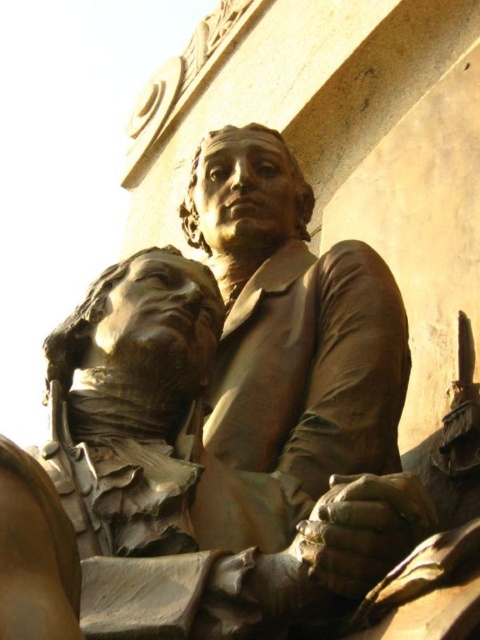
Question: Observing the image, what is the correct spatial positioning of bronze statue at center in reference to bronze bust at center?

Choices:
 (A) below
 (B) above

Answer: (B)

Question: Which point is farther to the camera?

Choices:
 (A) (317, 484)
 (B) (216, 317)

Answer: (B)

Question: Among these objects, which one is nearest to the camera?

Choices:
 (A) bronze bust at center
 (B) bronze statue at center

Answer: (A)

Question: Does bronze statue at center have a larger size compared to bronze bust at center?

Choices:
 (A) yes
 (B) no

Answer: (A)

Question: In this image, where is bronze statue at center located relative to bronze bust at center?

Choices:
 (A) below
 (B) above

Answer: (B)